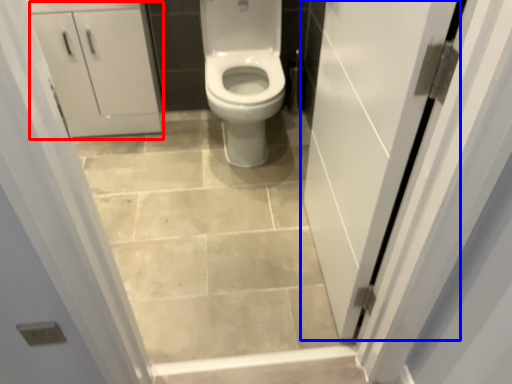
Question: Which of the following is the closest to the observer, cabinetry (highlighted by a red box) or door (highlighted by a blue box)?

Choices:
 (A) cabinetry
 (B) door

Answer: (B)